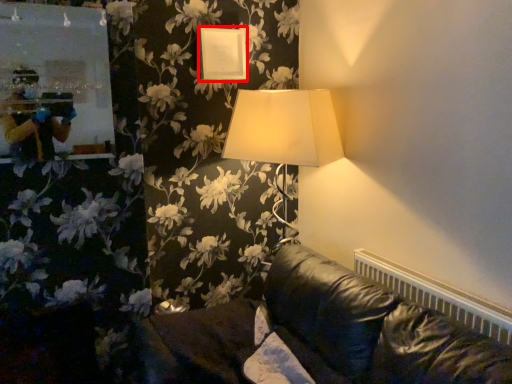
Question: From the image's perspective, where is picture frame (annotated by the red box) located relative to radiator?

Choices:
 (A) above
 (B) below

Answer: (A)